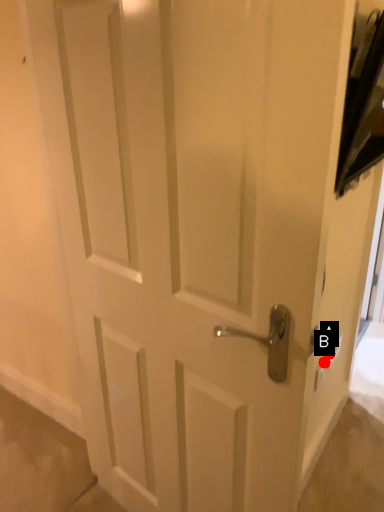
Question: Two points are circled on the image, labeled by A and B beside each circle. Among these points, which one is nearest to the camera?

Choices:
 (A) A is closer
 (B) B is closer

Answer: (B)